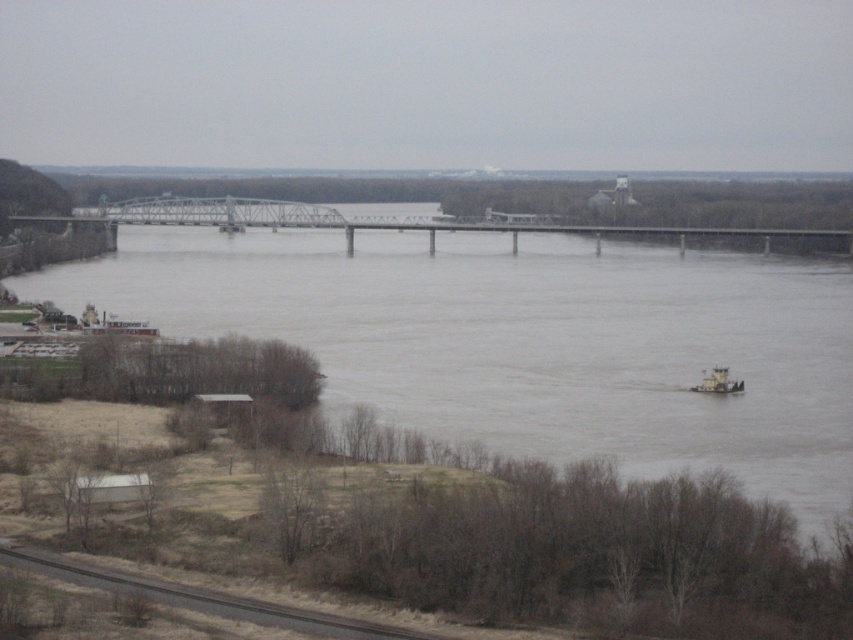
You are standing on the bank of the gray concrete river at center and want to cross to the other side. The metallic gray bridge at center is your only option. Since you can only walk towards the bridge, will you have to move forward or backward to reach it?

The gray concrete river at center is closer to the viewer than the metallic gray bridge at center. Therefore, to reach the bridge, you must move forward away from the river towards the bridge.

You are standing at the edge of the river and want to cross to the other side. The metallic gray bridge at center is the only crossing available. If your car has a maximum speed of 15 km per hour, how long will it take to drive across the bridge?

The distance between the metallic gray bridge at center and the viewer is 343.21 meters. To cross the bridge, you would need to travel 343.21 meters. Converting the car speed to meters per second, 15 km per hour is approximately 4.1667 m per second. Dividing distance by speed gives 343.21 meters divided by 4.1667 m per second equals approximately 82.3 seconds, which is about 1 minute and 22 seconds.

You are a photographer trying to capture the entire scene of the gray concrete river at center and the metallic gray tugboat at lower right in one shot. Based on their sizes, which object should you focus on first to ensure both are in frame?

The gray concrete river at center is bigger than the metallic gray tugboat at lower right, so you should focus on the gray concrete river at center first to ensure both fit in the frame.